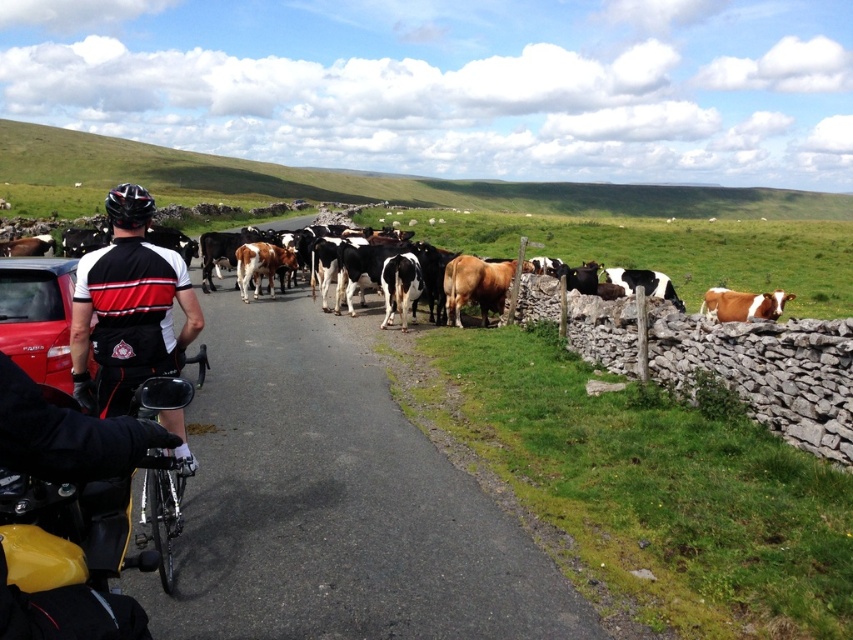
Question: Which object is closer to the camera taking this photo?

Choices:
 (A) matte black car at left
 (B) black and white cycling jersey at center

Answer: (B)

Question: Where is black and white cycling jersey at center located in relation to matte black car at left in the image?

Choices:
 (A) left
 (B) right

Answer: (B)

Question: Is the position of black and white cycling jersey at center more distant than that of matte black car at left?

Choices:
 (A) no
 (B) yes

Answer: (A)

Question: Which point is closer to the camera taking this photo?

Choices:
 (A) (33, 344)
 (B) (120, 198)

Answer: (B)

Question: Does black and white cycling jersey at center appear under matte black car at left?

Choices:
 (A) no
 (B) yes

Answer: (B)